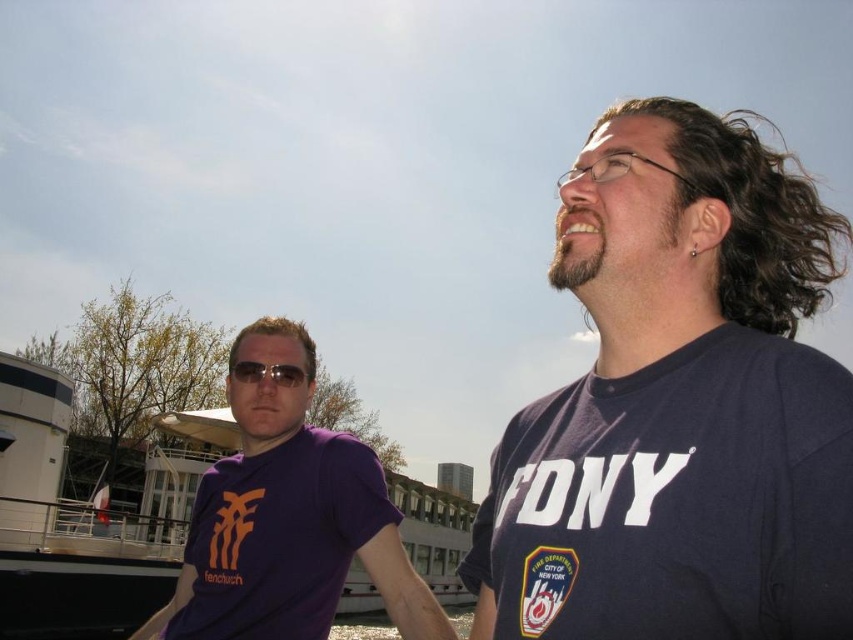
Between dark blue t-shirt at upper right and matte black sunglasses at center, which one is positioned lower?

matte black sunglasses at center is below.

Locate an element on the screen. dark blue t-shirt at upper right is located at coordinates (682, 401).

Is purple matte t-shirt at left below purple matte t-shirt at center?

Indeed, purple matte t-shirt at left is positioned under purple matte t-shirt at center.

Who is taller, purple matte t-shirt at left or purple matte t-shirt at center?

With more height is purple matte t-shirt at left.

Is point (346, 545) closer to viewer compared to point (314, 433)?

Yes, point (346, 545) is in front of point (314, 433).

Where is `purple matte t-shirt at left`? This screenshot has width=853, height=640. purple matte t-shirt at left is located at coordinates (288, 518).

Can you confirm if dark blue t-shirt at upper right is positioned to the right of purple matte t-shirt at left?

Yes, dark blue t-shirt at upper right is to the right of purple matte t-shirt at left.

Is point (672, 180) in front of point (311, 490)?

Yes, point (672, 180) is in front of point (311, 490).

Find the location of `dark blue t-shirt at upper right`. dark blue t-shirt at upper right is located at coordinates coord(682,401).